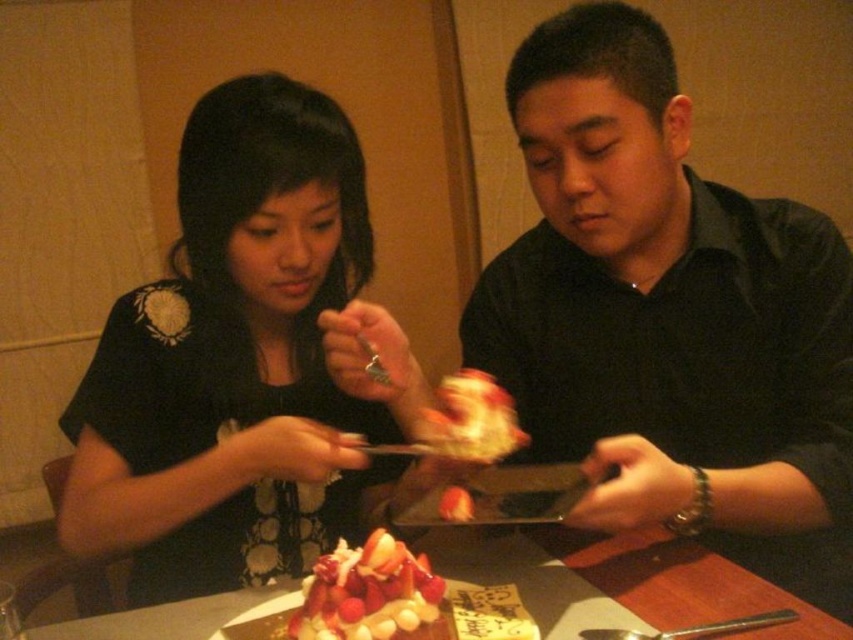
Is point (683, 584) farther from camera compared to point (467, 369)?

No, it is not.

How much distance is there between wooden table at center and slightly blurred white cake at center?

A distance of 8.65 inches exists between wooden table at center and slightly blurred white cake at center.

The image size is (853, 640). What do you see at coordinates (624, 579) in the screenshot? I see `wooden table at center` at bounding box center [624, 579].

This screenshot has height=640, width=853. What are the coordinates of `wooden table at center` in the screenshot? It's located at (624, 579).

Who is shorter, frosted white cake at center or slightly blurred white cake at center?

With less height is slightly blurred white cake at center.

Can you confirm if frosted white cake at center is smaller than slightly blurred white cake at center?

Yes.

I want to click on frosted white cake at center, so click(367, 593).

Can you confirm if matte black dress at center is positioned to the left of slightly blurred white cake at center?

Yes, matte black dress at center is to the left of slightly blurred white cake at center.

Who is shorter, matte black dress at center or slightly blurred white cake at center?

Standing shorter between the two is slightly blurred white cake at center.

Does point (96, 445) lie behind point (433, 433)?

Yes, it is.

Image resolution: width=853 pixels, height=640 pixels. I want to click on matte black dress at center, so pyautogui.click(x=241, y=360).